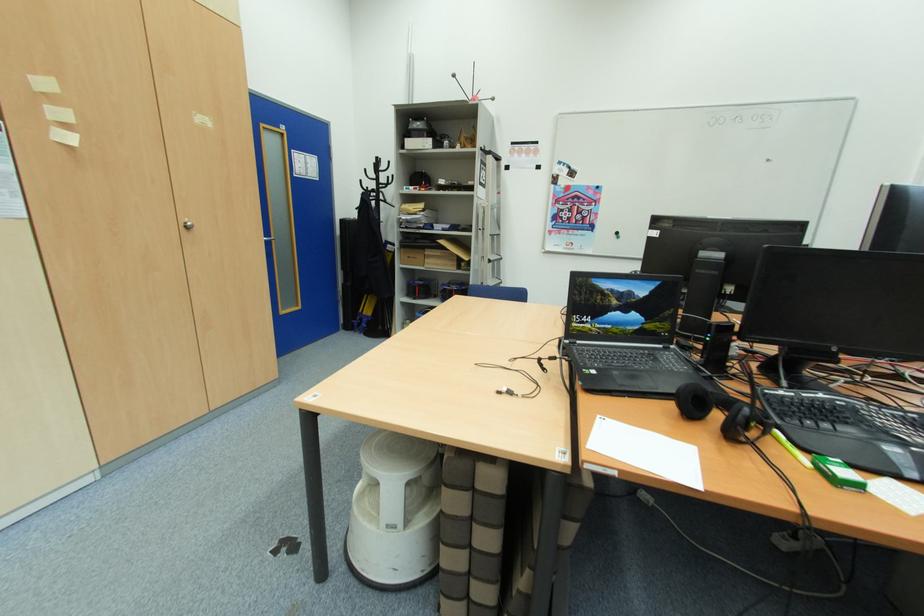
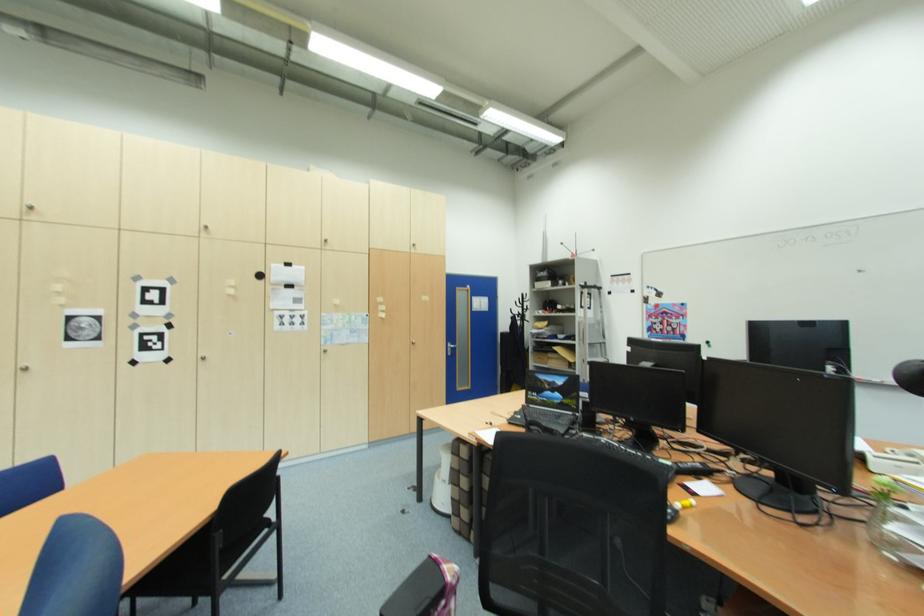
Where in the second image is the point corresponding to pixel 652 328 from the first image?

(569, 402)